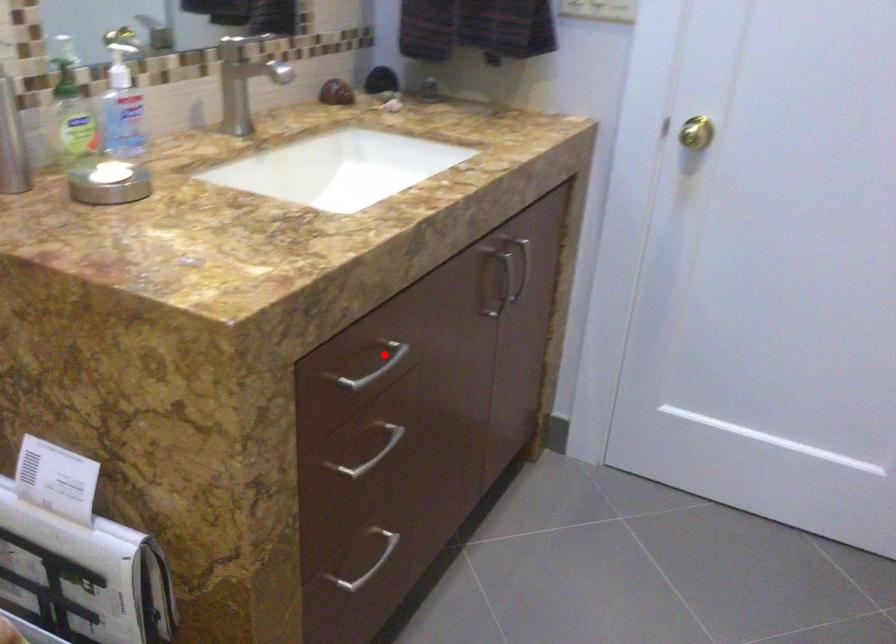
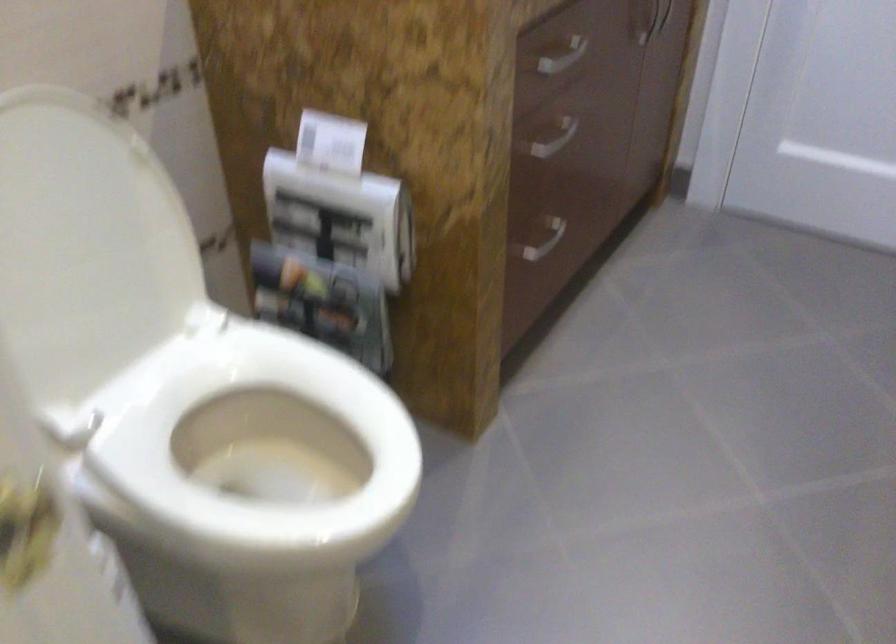
Find the pixel in the second image that matches the highlighted location in the first image.

(562, 57)